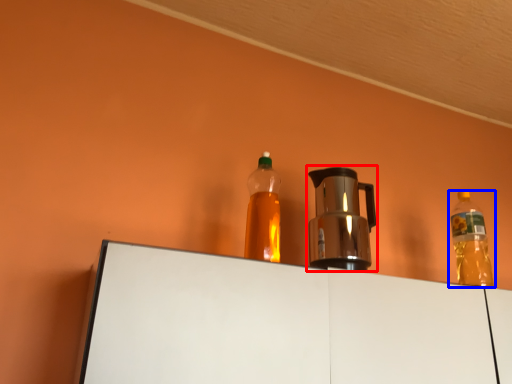
Question: Which object is closer to the camera taking this photo, coffeepot (highlighted by a red box) or bottle (highlighted by a blue box)?

Choices:
 (A) coffeepot
 (B) bottle

Answer: (A)